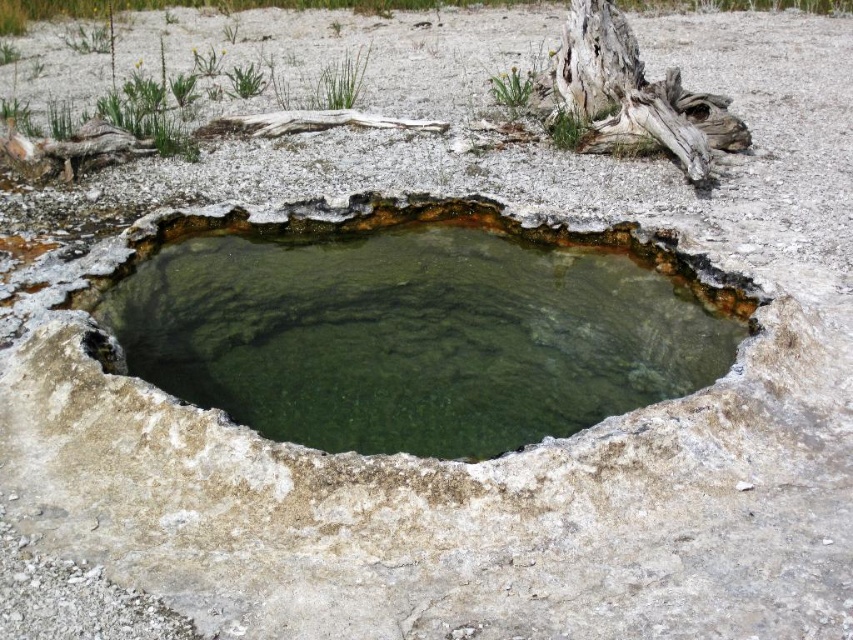
Based on the photo, which is more to the left, green algae at upper center or green algae at upper left?

green algae at upper left is more to the left.

From the picture: Can you confirm if green algae at upper center is positioned to the right of green algae at upper left?

Indeed, green algae at upper center is positioned on the right side of green algae at upper left.

What do you see at coordinates (566, 129) in the screenshot? I see `green algae at upper center` at bounding box center [566, 129].

I want to click on green algae at upper center, so click(x=566, y=129).

Is green stone pond at center below green grass at upper center?

Correct, green stone pond at center is located below green grass at upper center.

Between green stone pond at center and green grass at upper center, which one has less height?

green stone pond at center

This screenshot has height=640, width=853. What do you see at coordinates (416, 324) in the screenshot? I see `green stone pond at center` at bounding box center [416, 324].

Locate an element on the screen. The image size is (853, 640). green stone pond at center is located at coordinates (416, 324).

Is gray weathered wood at upper center closer to the viewer compared to green leafy algae at upper center?

Yes, gray weathered wood at upper center is closer to the viewer.

Image resolution: width=853 pixels, height=640 pixels. I want to click on gray weathered wood at upper center, so click(635, 97).